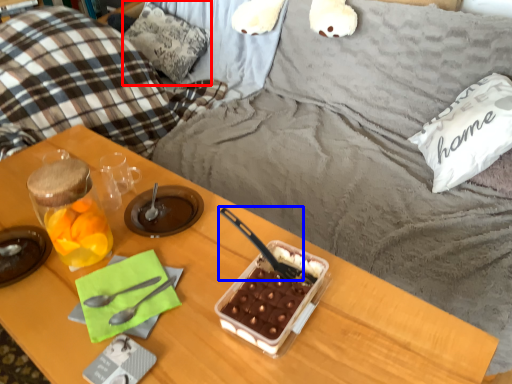
Question: Which object appears closest to the camera in this image, pillow (highlighted by a red box) or spoon (highlighted by a blue box)?

Choices:
 (A) pillow
 (B) spoon

Answer: (B)